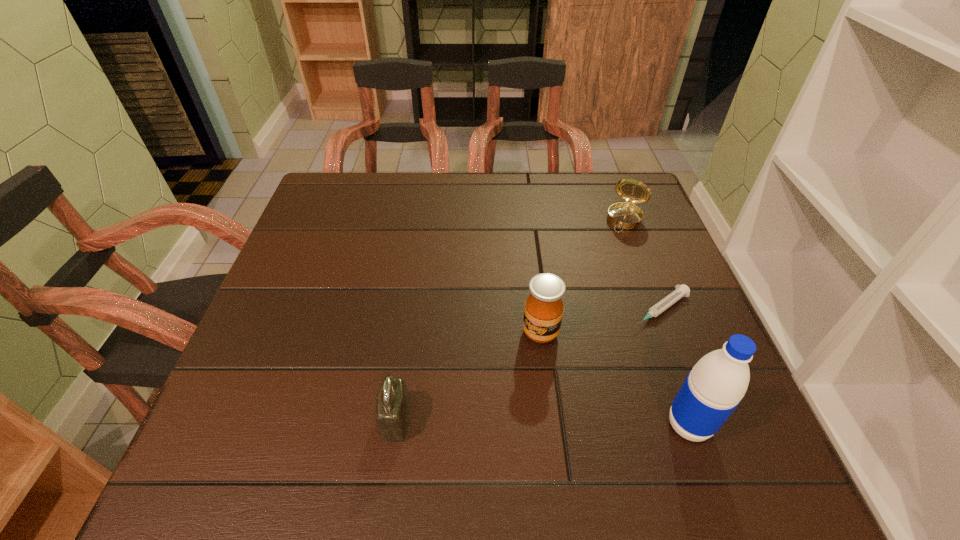
You are a GUI agent. You are given a task and a screenshot of the screen. Output one action in this format:
    pyautogui.click(x=<x>, y=<y>)
    Task: Click on the padlock situated at the near edge
    The width and height of the screenshot is (960, 540).
    Given the screenshot: What is the action you would take?
    pyautogui.click(x=393, y=404)

You are a GUI agent. You are given a task and a screenshot of the screen. Output one action in this format:
    pyautogui.click(x=<x>, y=<y>)
    Task: Click on the water bottle present at the near edge
    Image resolution: width=960 pixels, height=540 pixels.
    Given the screenshot: What is the action you would take?
    pyautogui.click(x=715, y=386)

Where is `water bottle that is positioned at the right edge`? This screenshot has height=540, width=960. water bottle that is positioned at the right edge is located at coordinates (715, 386).

Find the location of a particular element. Image resolution: width=960 pixels, height=540 pixels. compass located at the right edge is located at coordinates (626, 215).

The width and height of the screenshot is (960, 540). In order to click on syringe present at the right edge in this screenshot , I will do `click(682, 290)`.

Image resolution: width=960 pixels, height=540 pixels. Find the location of `object that is at the far right corner`. object that is at the far right corner is located at coordinates (626, 215).

Identify the location of object located at the near right corner. This screenshot has height=540, width=960. (715, 386).

Find the location of `vacant space at the far edge of the desktop`. vacant space at the far edge of the desktop is located at coordinates (492, 211).

Find the location of a particular element. The width and height of the screenshot is (960, 540). vacant area at the left edge is located at coordinates (304, 361).

Image resolution: width=960 pixels, height=540 pixels. Find the location of `free location at the right edge of the desktop`. free location at the right edge of the desktop is located at coordinates (662, 246).